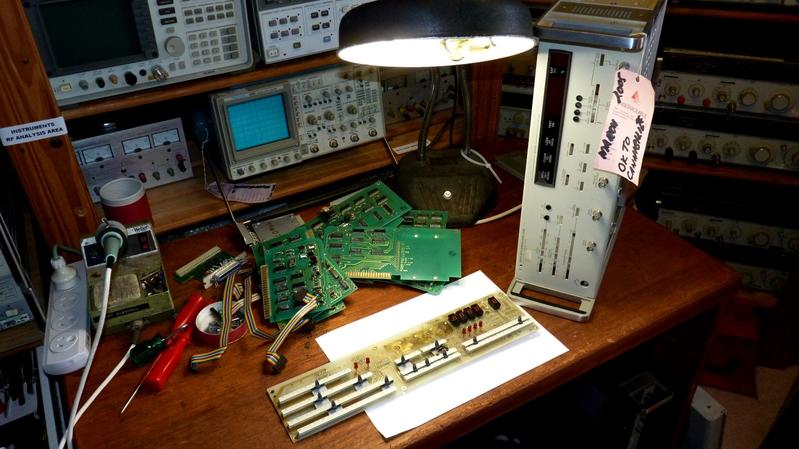
This screenshot has height=449, width=799. Find the location of `powerstrip`. powerstrip is located at coordinates (65, 315).